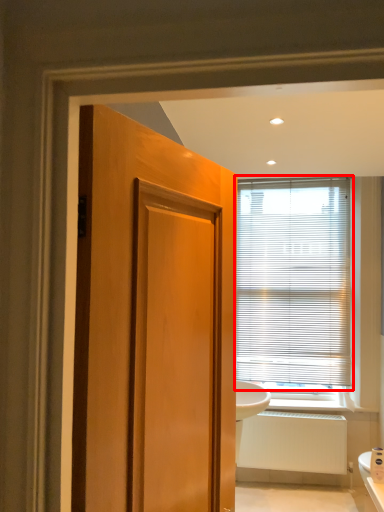
Question: From the image's perspective, what is the correct spatial relationship of window blind (annotated by the red box) in relation to radiator?

Choices:
 (A) above
 (B) below

Answer: (A)